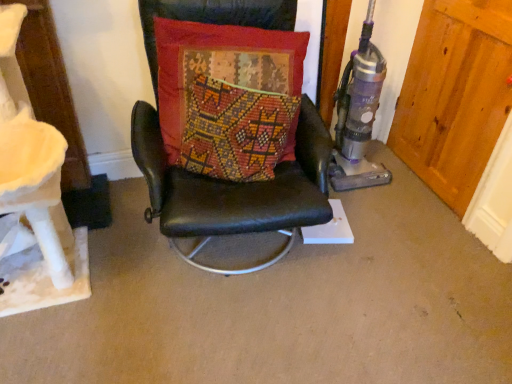
Question: Can you confirm if textured red cushion at center is thinner than wooden door at right?

Choices:
 (A) yes
 (B) no

Answer: (B)

Question: Is textured red cushion at center smaller than wooden door at right?

Choices:
 (A) yes
 (B) no

Answer: (B)

Question: Would you consider textured red cushion at center to be distant from wooden door at right?

Choices:
 (A) no
 (B) yes

Answer: (A)

Question: Considering the relative sizes of textured red cushion at center and wooden door at right in the image provided, is textured red cushion at center wider than wooden door at right?

Choices:
 (A) yes
 (B) no

Answer: (A)

Question: Considering the relative sizes of textured red cushion at center and wooden door at right in the image provided, is textured red cushion at center bigger than wooden door at right?

Choices:
 (A) yes
 (B) no

Answer: (A)

Question: From the image's perspective, is wooden door at right above or below black leather chair at center?

Choices:
 (A) below
 (B) above

Answer: (B)

Question: Would you say wooden door at right is inside or outside black leather chair at center?

Choices:
 (A) outside
 (B) inside

Answer: (A)

Question: Is wooden door at right to the left or to the right of black leather chair at center in the image?

Choices:
 (A) left
 (B) right

Answer: (B)

Question: In terms of height, does wooden door at right look taller or shorter compared to black leather chair at center?

Choices:
 (A) tall
 (B) short

Answer: (B)

Question: Would you say wooden door at right is to the left or to the right of textured red cushion at center in the picture?

Choices:
 (A) left
 (B) right

Answer: (B)

Question: From the image's perspective, is wooden door at right located above or below textured red cushion at center?

Choices:
 (A) below
 (B) above

Answer: (B)

Question: Considering their positions, is wooden door at right located in front of or behind textured red cushion at center?

Choices:
 (A) behind
 (B) front

Answer: (A)

Question: From a real-world perspective, is wooden door at right above or below textured red cushion at center?

Choices:
 (A) above
 (B) below

Answer: (B)

Question: Visually, is textured red cushion at center positioned to the left or to the right of wooden door at right?

Choices:
 (A) right
 (B) left

Answer: (B)

Question: In the image, is textured red cushion at center positioned in front of or behind wooden door at right?

Choices:
 (A) front
 (B) behind

Answer: (A)